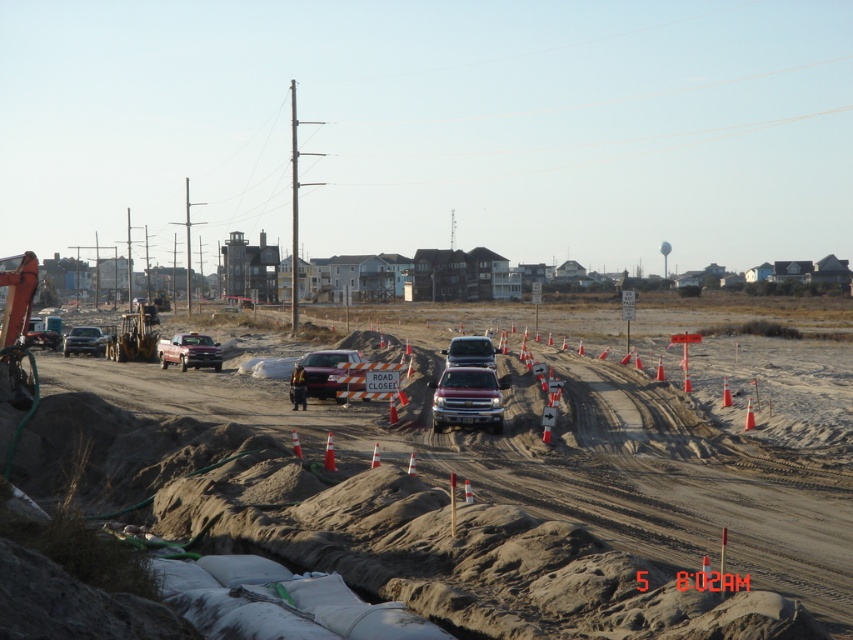
You are a delivery driver who needs to navigate through the construction site shown in the image. There is a matte orange traffic cone at center marked by point (439, 502). Can you safely drive around it without crossing the road closure area?

The matte orange traffic cone at center marked by point (439, 502) is part of the road closure markers. Since the cones are indicating a closed road, you should not cross that area and must find an alternative route to avoid the road closure.

You are a delivery driver who needs to park your truck in the construction site. The parking spot can only accommodate trucks smaller than the matte black truck at left. Can you park your truck if you have the matte black truck at center?

The matte black truck at center is smaller than the matte black truck at left, so yes, you can park your truck in the parking spot.